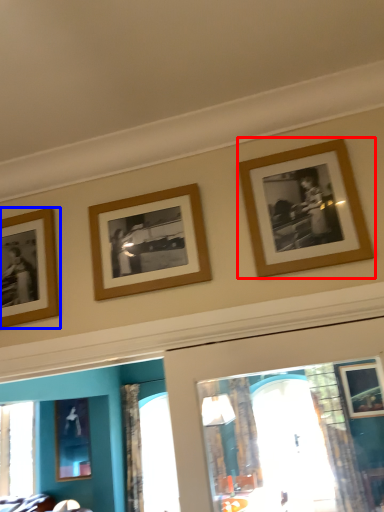
Question: Which object appears closest to the camera in this image, picture frame (highlighted by a red box) or picture frame (highlighted by a blue box)?

Choices:
 (A) picture frame
 (B) picture frame

Answer: (A)